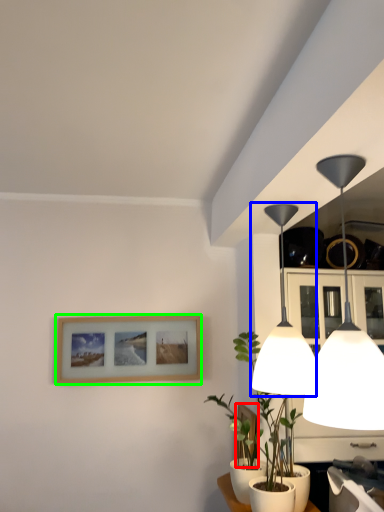
Question: Which object is positioned farthest from picture frame (highlighted by a red box)? Select from lamp (highlighted by a blue box) and picture frame (highlighted by a green box).

Choices:
 (A) lamp
 (B) picture frame

Answer: (A)